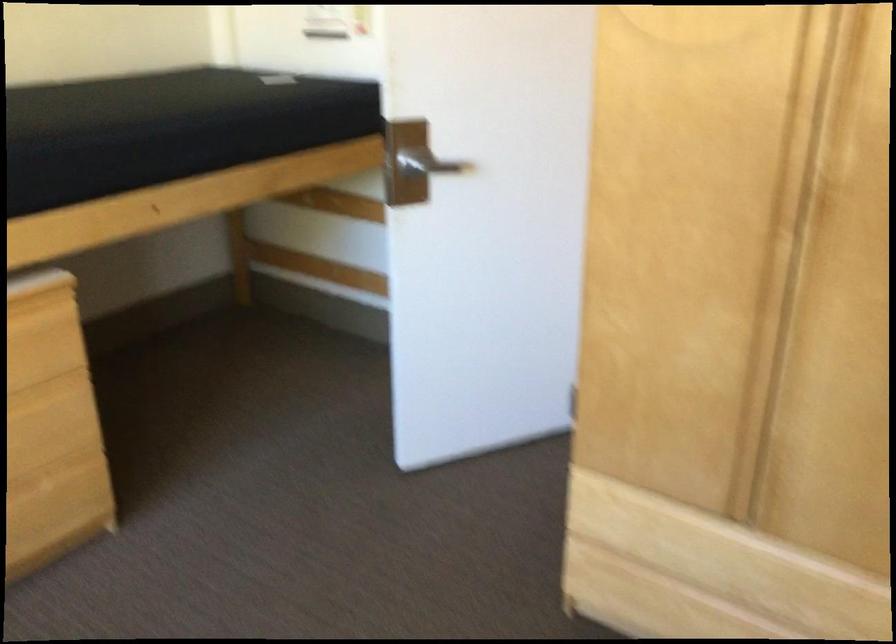
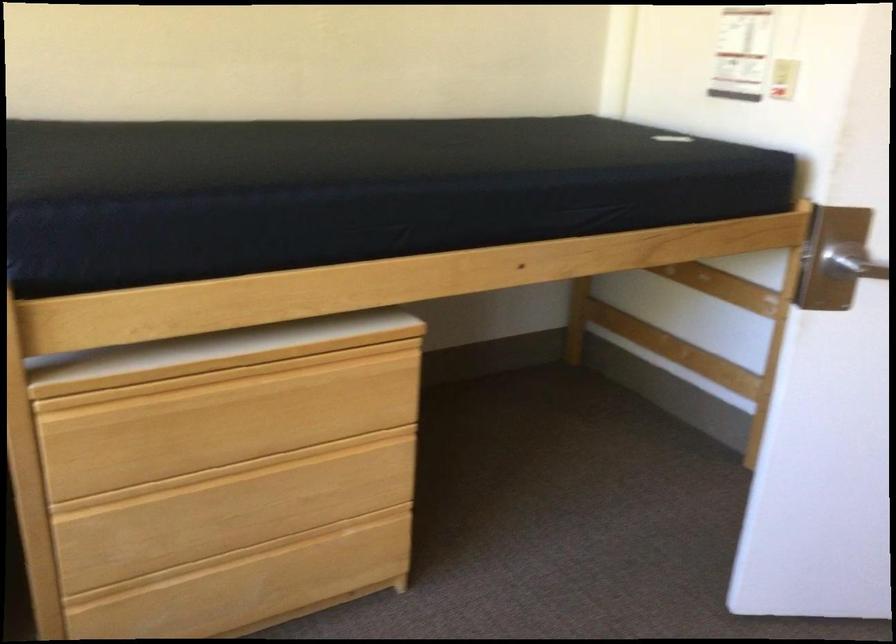
Find the pixel in the second image that matches point (424, 166) in the first image.

(851, 261)